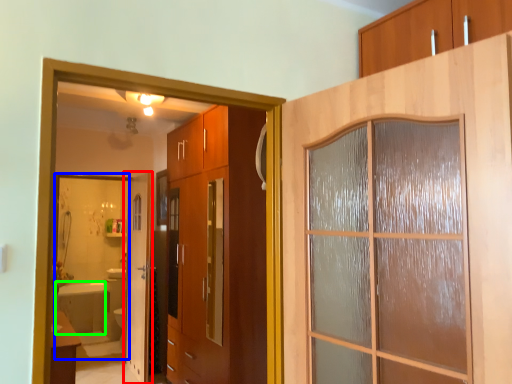
Question: Which object is positioned closest to door (highlighted by a red box)? Select from mirror (highlighted by a blue box) and bath (highlighted by a green box).

Choices:
 (A) mirror
 (B) bath

Answer: (A)